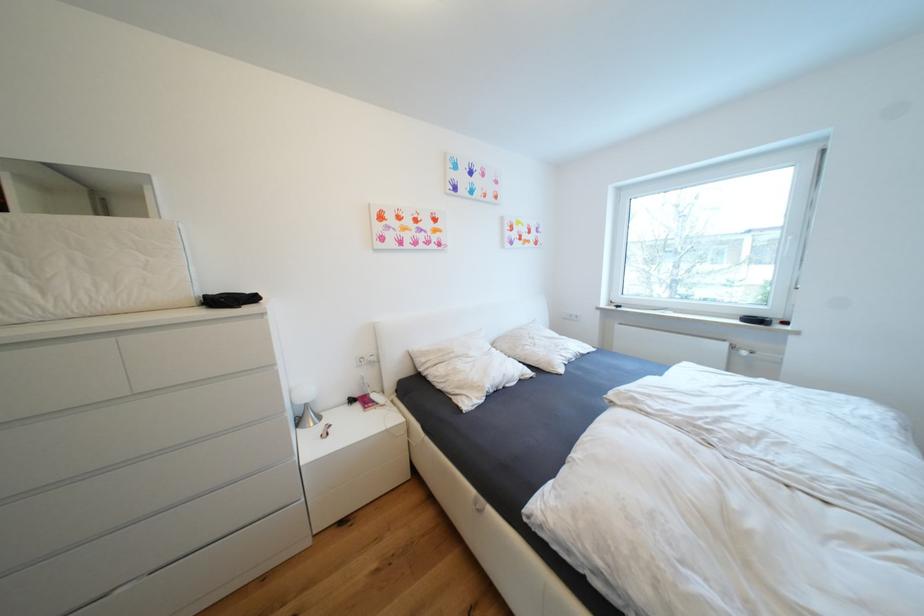
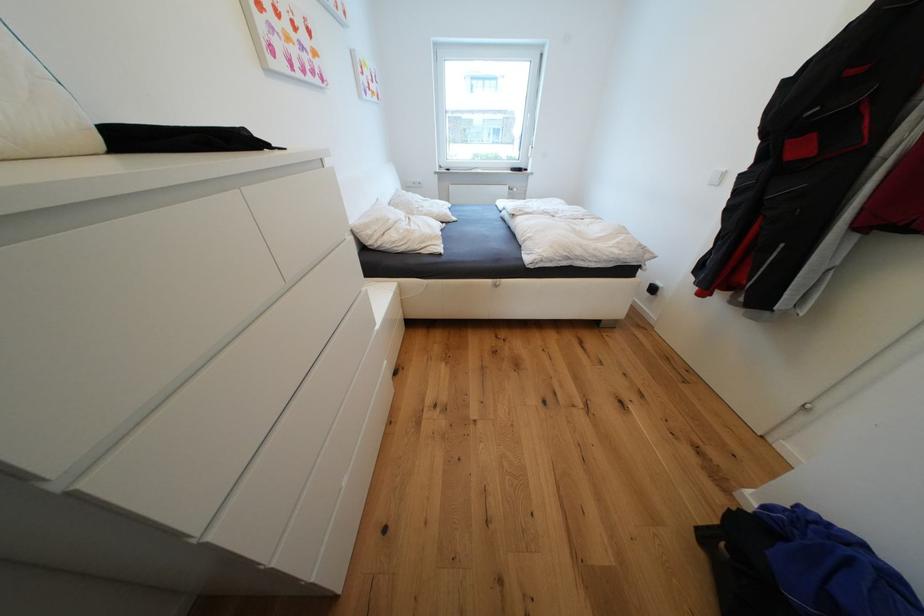
Find the pixel in the second image that matches pixel 640 400 in the first image.

(528, 212)